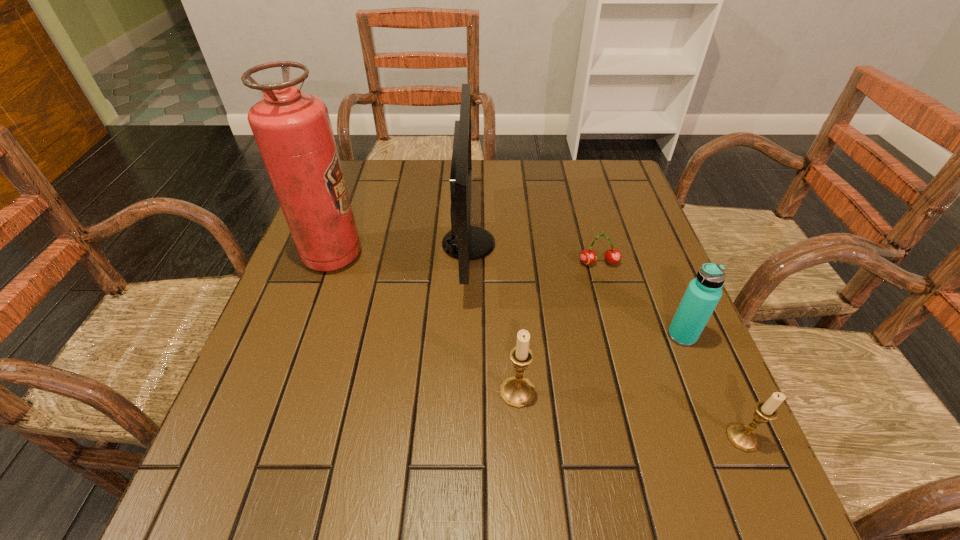
What are the coordinates of `vacant space that satisfies the following two spatial constraints: 1. on the back side of the shorter candle holder; 2. on the label side of the fire extinguisher` in the screenshot? It's located at (663, 255).

What are the coordinates of `free space in the image that satisfies the following two spatial constraints: 1. on the back side of the nearer candle holder; 2. on the label side of the tallest object` in the screenshot? It's located at (663, 255).

At what (x,y) coordinates should I click in order to perform the action: click on free space that satisfies the following two spatial constraints: 1. on the label side of the water bottle; 2. on the right side of the tallest object. Please return your answer as a coordinate pair (x, y). Looking at the image, I should click on (304, 335).

Locate an element on the screen. vacant region that satisfies the following two spatial constraints: 1. on the label side of the nearer candle holder; 2. on the left side of the leftmost object is located at coordinates (268, 437).